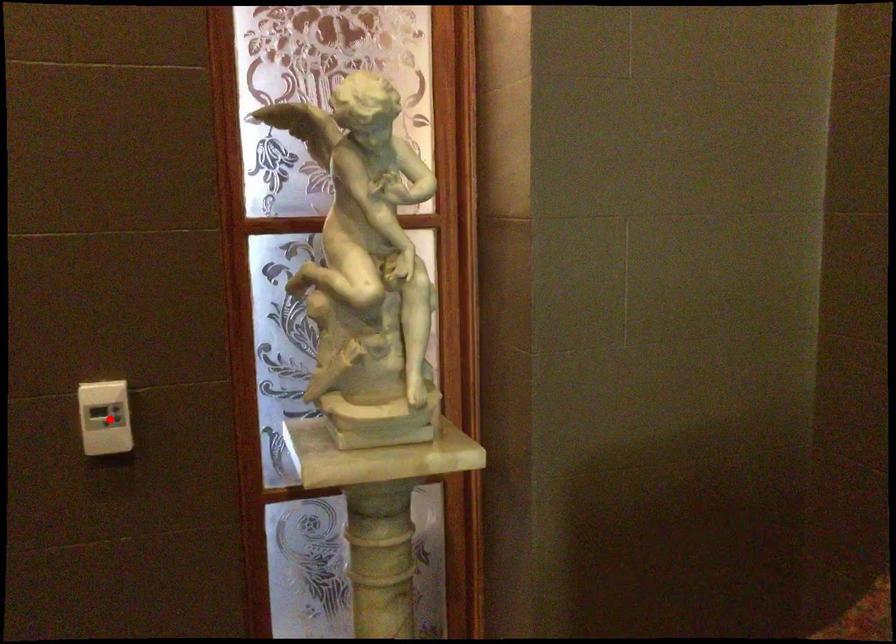
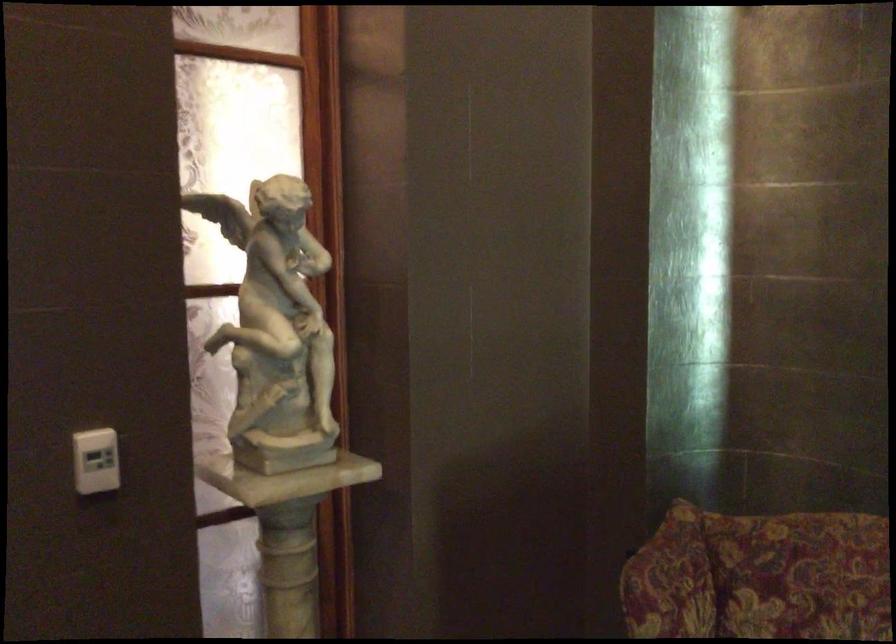
Locate, in the second image, the point that corresponds to the highlighted location in the first image.

(95, 460)